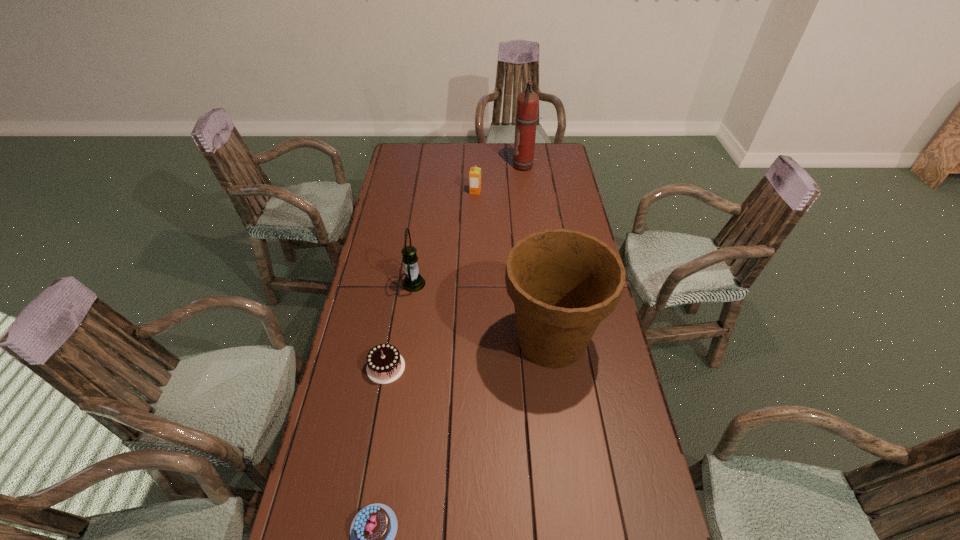
At what (x,y) coordinates should I click in order to perform the action: click on flowerpot located at the right edge. Please return your answer as a coordinate pair (x, y). This screenshot has width=960, height=540. Looking at the image, I should click on (563, 283).

In order to click on object that is at the far right corner in this screenshot , I will do `click(527, 101)`.

In the image, there is a desktop. At what (x,y) coordinates should I click in order to perform the action: click on vacant space at the far edge. Please return your answer as a coordinate pair (x, y). The width and height of the screenshot is (960, 540). Looking at the image, I should click on (511, 151).

This screenshot has height=540, width=960. Identify the location of free location at the left edge. (400, 183).

Identify the location of free space at the right edge of the desktop. (552, 220).

You are a GUI agent. You are given a task and a screenshot of the screen. Output one action in this format:
    pyautogui.click(x=<x>, y=<y>)
    Task: Click on the vacant space at the far left corner of the desktop
    This screenshot has height=540, width=960.
    Given the screenshot: What is the action you would take?
    pyautogui.click(x=413, y=144)

In the image, there is a desktop. What are the coordinates of `blank space at the far right corner` in the screenshot? It's located at (561, 161).

The height and width of the screenshot is (540, 960). I want to click on vacant point located between the farthest object and the third shortest object, so click(500, 179).

The width and height of the screenshot is (960, 540). In order to click on free space between the tallest object and the fifth nearest object in this screenshot , I will do `click(500, 179)`.

Identify the location of vacant space that is in between the tallest object and the third farthest object. (469, 225).